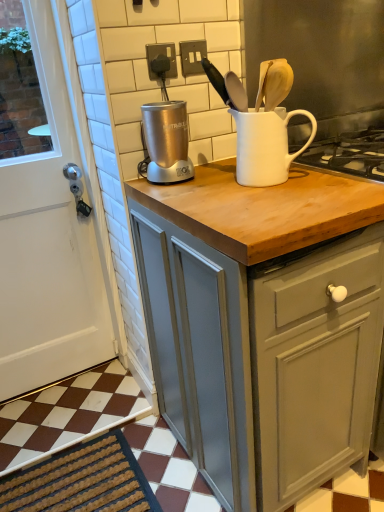
Find the location of a particular element. This screenshot has width=384, height=512. empty space that is ontop of dark brown textured mat at lower left is located at coordinates (77, 476).